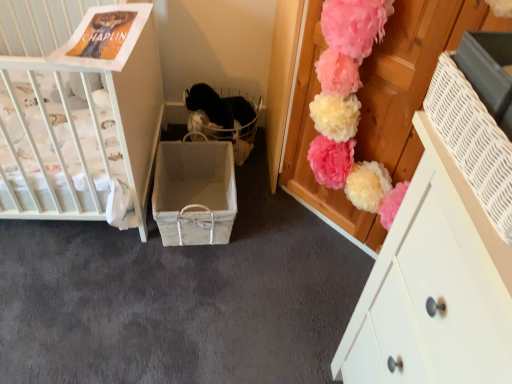
Question: Does white wicker basket at right, placed as the second storage box when sorted from left to right, have a smaller size compared to white painted wood cabinet at upper right?

Choices:
 (A) no
 (B) yes

Answer: (B)

Question: Is white wicker basket at right, marked as the 1th storage box in a right-to-left arrangement, positioned before white painted wood cabinet at upper right?

Choices:
 (A) no
 (B) yes

Answer: (B)

Question: Does white wicker basket at right, which is the 2th storage box from back to front, have a larger size compared to white painted wood cabinet at upper right?

Choices:
 (A) no
 (B) yes

Answer: (A)

Question: Is white wicker basket at right, placed as the second storage box when sorted from left to right, turned away from white painted wood cabinet at upper right?

Choices:
 (A) no
 (B) yes

Answer: (A)

Question: Does white wicker basket at right, which is the 2th storage box from back to front, touch white painted wood cabinet at upper right?

Choices:
 (A) yes
 (B) no

Answer: (B)

Question: From a real-world perspective, is white wicker basket at right, placed as the second storage box when sorted from left to right, over white painted wood cabinet at upper right?

Choices:
 (A) yes
 (B) no

Answer: (A)

Question: Is white painted wood cabinet at upper right positioned with its back to white wicker basket at center, which ranks as the 2th storage box in front-to-back order?

Choices:
 (A) no
 (B) yes

Answer: (A)

Question: Is white painted wood cabinet at upper right to the right of white wicker basket at center, which ranks as the 2th storage box in front-to-back order, from the viewer's perspective?

Choices:
 (A) yes
 (B) no

Answer: (A)

Question: Considering the relative sizes of white painted wood cabinet at upper right and white wicker basket at center, marked as the 2th storage box in a right-to-left arrangement, in the image provided, is white painted wood cabinet at upper right taller than white wicker basket at center, marked as the 2th storage box in a right-to-left arrangement,?

Choices:
 (A) yes
 (B) no

Answer: (A)

Question: Can you see white painted wood cabinet at upper right touching white wicker basket at center, the first storage box in the left-to-right sequence?

Choices:
 (A) yes
 (B) no

Answer: (B)

Question: Is the depth of white painted wood cabinet at upper right less than that of white wicker basket at center, which ranks as the 2th storage box in front-to-back order?

Choices:
 (A) no
 (B) yes

Answer: (B)

Question: Would you say white painted wood cabinet at upper right is outside white wicker basket at center, which ranks as the 2th storage box in front-to-back order?

Choices:
 (A) yes
 (B) no

Answer: (A)

Question: Considering the relative sizes of white painted wood cabinet at upper right and white wicker basket at right, placed as the second storage box when sorted from left to right, in the image provided, is white painted wood cabinet at upper right wider than white wicker basket at right, placed as the second storage box when sorted from left to right,?

Choices:
 (A) no
 (B) yes

Answer: (B)